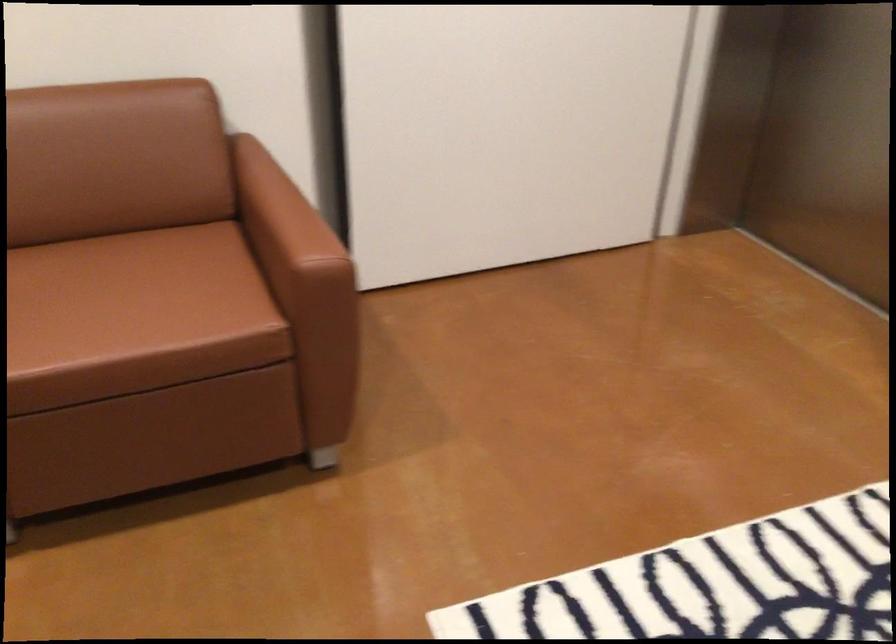
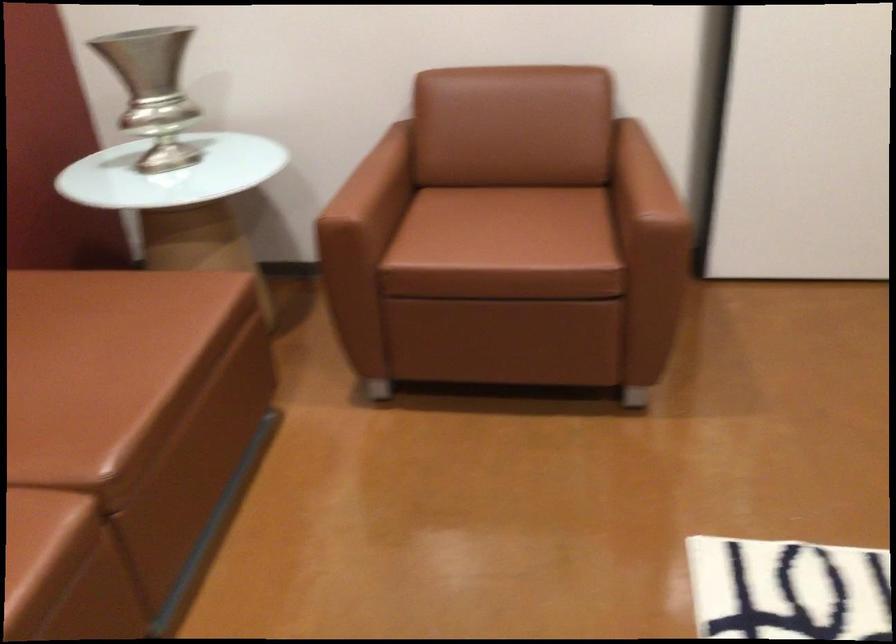
Locate, in the second image, the point that corresponds to point 117,301 in the first image.

(497, 228)